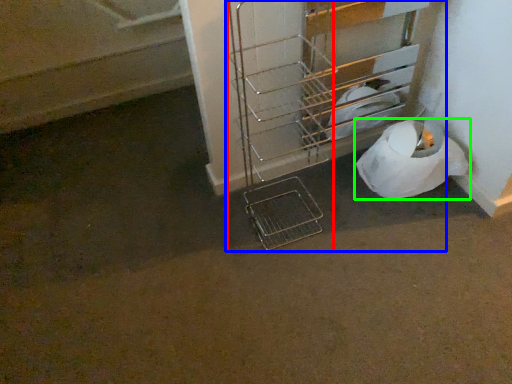
Question: Estimate the real-world distances between objects in this image. Which object is farther from trolley (highlighted by a red box), trolley (highlighted by a blue box) or toilet paper (highlighted by a green box)?

Choices:
 (A) trolley
 (B) toilet paper

Answer: (B)